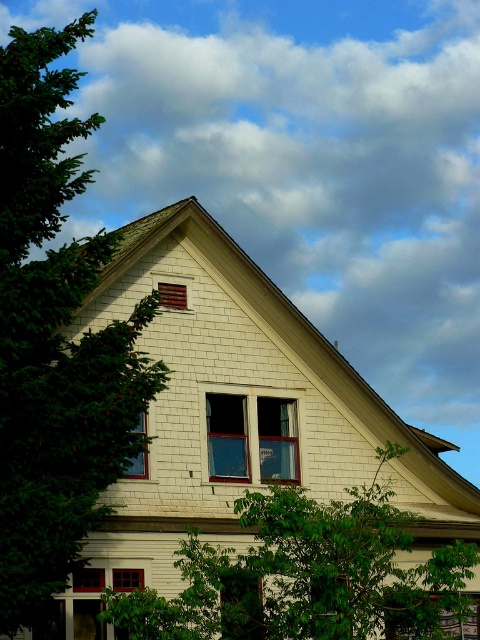
Question: In this image, where is white fluffy cloud at upper center located relative to matte wooden window at lower left?

Choices:
 (A) above
 (B) below

Answer: (A)

Question: Where is white fluffy cloud at upper center located in relation to clear glass window at center in the image?

Choices:
 (A) below
 (B) above

Answer: (B)

Question: Which object is positioned closest to the clear glass window at center?

Choices:
 (A) matte glass window at center
 (B) matte wooden window at lower left

Answer: (A)

Question: Based on their relative distances, which object is farther from the matte wooden window at lower left?

Choices:
 (A) green leafy tree at lower center
 (B) green leafy tree at left

Answer: (B)

Question: Which point is closer to the camera?

Choices:
 (A) clear glass window at center
 (B) matte wooden window at lower left

Answer: (B)

Question: Can you confirm if white fluffy cloud at upper center is smaller than green leafy tree at lower center?

Choices:
 (A) no
 (B) yes

Answer: (A)